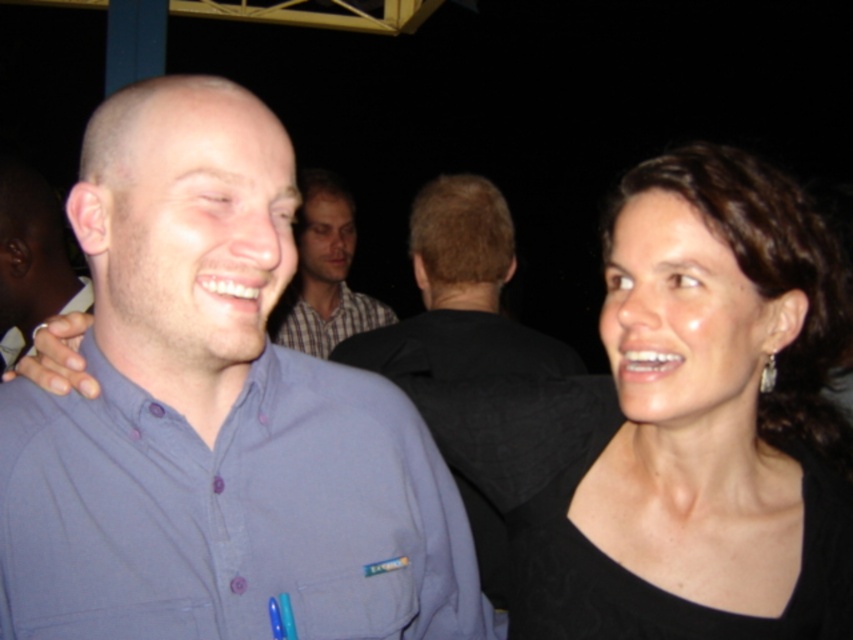
Can you confirm if black matte dress at upper right is bigger than dark gray fabric jacket at center?

No.

Between point (648, 317) and point (547, 339), which one is positioned in front?

Point (648, 317) is more forward.

Between point (680, 360) and point (451, 264), which one is positioned behind?

Positioned behind is point (451, 264).

This screenshot has width=853, height=640. I want to click on black matte dress at upper right, so click(715, 374).

Where is `blue button-down shirt at center`? This screenshot has width=853, height=640. blue button-down shirt at center is located at coordinates (215, 417).

Can you confirm if blue button-down shirt at center is thinner than black matte dress at upper right?

Incorrect, blue button-down shirt at center's width is not less than black matte dress at upper right's.

Locate an element on the screen. blue button-down shirt at center is located at coordinates (215, 417).

Who is positioned more to the right, dark gray fabric jacket at center or plaid shirt at center?

dark gray fabric jacket at center is more to the right.

Is point (502, 580) behind point (294, 307)?

No, it is not.

Locate an element on the screen. This screenshot has width=853, height=640. dark gray fabric jacket at center is located at coordinates (459, 296).